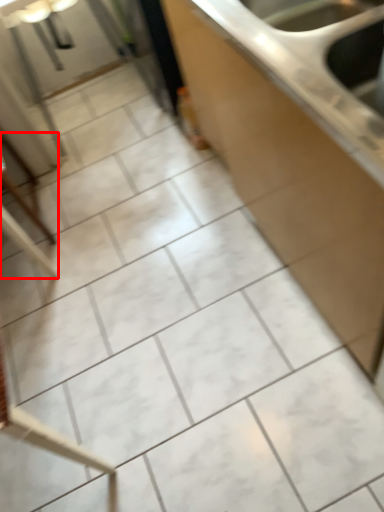
Question: From the image's perspective, considering the relative positions of furniture (annotated by the red box) and countertop in the image provided, where is furniture (annotated by the red box) located with respect to the staircase?

Choices:
 (A) above
 (B) below

Answer: (B)